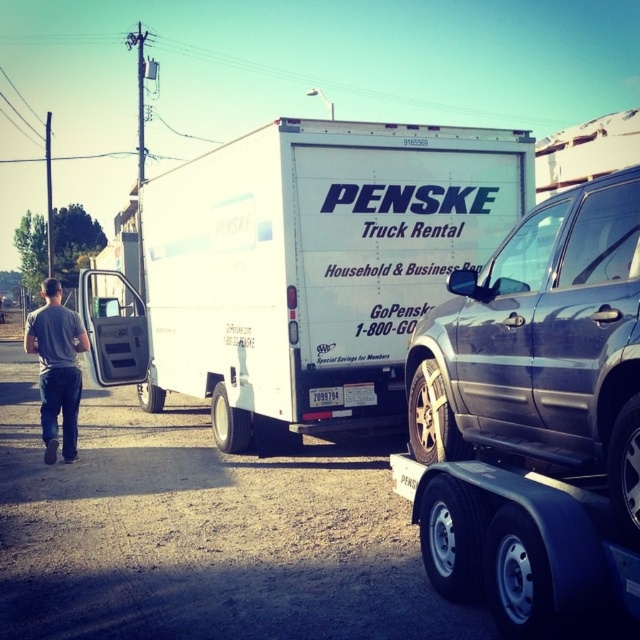
You are a delivery driver who needs to back up your vehicle from the parking spot. You see the white matte truck at center and the metallic gray suv at right. Which vehicle is closer to the left side so you can judge your backing path?

The white matte truck at center is to the left of the metallic gray suv at right, so it is closer to the left side.

You are a delivery driver who needs to back out of a parking lot. You see a white matte truck at center and a metallic gray suv at right. Which vehicle should you avoid hitting as you back out?

You should avoid hitting the white matte truck at center because it is closer to you than the metallic gray suv at right.

You are standing in the parking lot and notice the metallic gray suv at right and the gray cotton shirt at center. Which object is shorter in height?

The metallic gray suv at right is shorter in height compared to the gray cotton shirt at center.